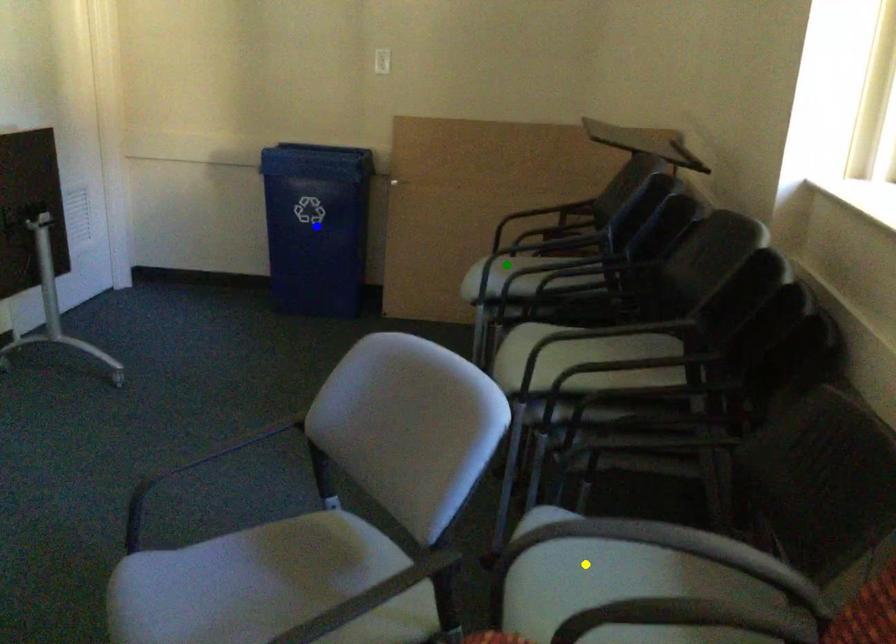
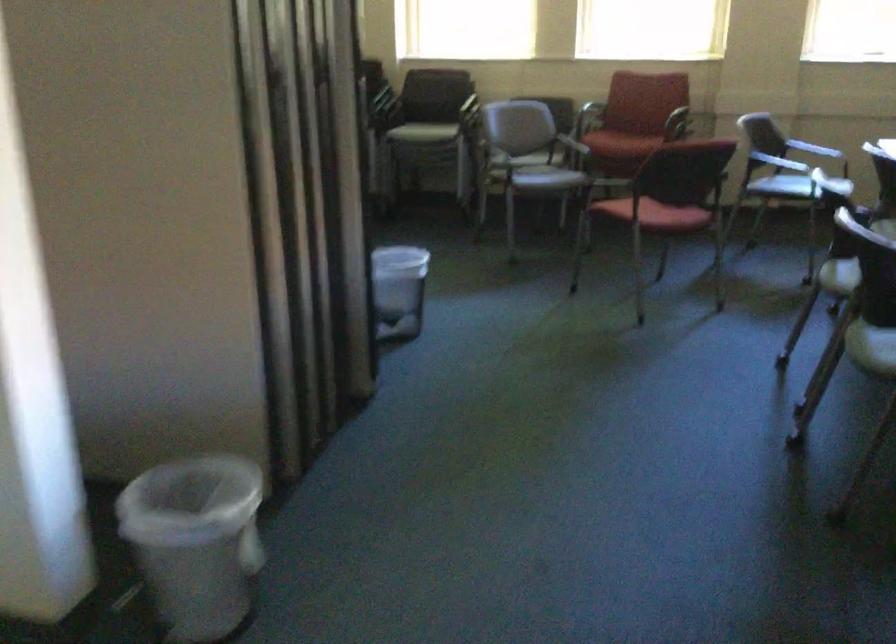
I am providing you with two images of the same scene from different viewpoints. Three points are marked in image1. Which point corresponds to a part or object that is occluded in image2?In image1, three points are marked. Which of them correspond to a part or object that is occluded in image2?Among the three points shown in image1, which one corresponds to a part or object that is no longer visible due to occlusion in image2?

blue point, green point, yellow point